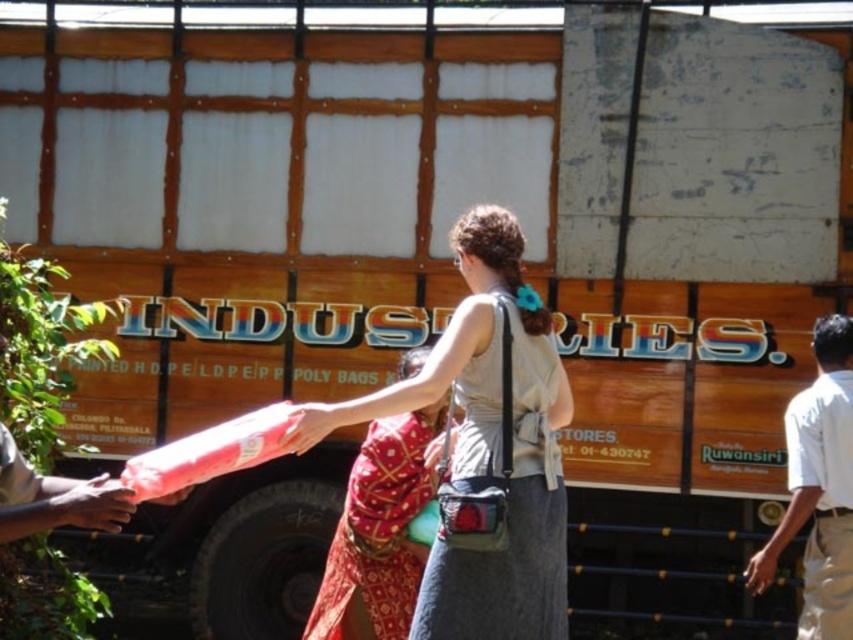
Question: Which of the following is the closest to the observer?

Choices:
 (A) matte red bag at center
 (B) smooth skin hand at lower left

Answer: (B)

Question: Estimate the real-world distances between objects in this image. Which object is closer to the pink fabric at center?

Choices:
 (A) matte beige tank top at center
 (B) red printed pants at center
 (C) matte red bag at center

Answer: (A)

Question: Can you confirm if matte black hand at lower right is positioned to the left of matte red bag at center?

Choices:
 (A) no
 (B) yes

Answer: (A)

Question: Observing the image, what is the correct spatial positioning of matte beige tank top at center in reference to pink fabric at center?

Choices:
 (A) left
 (B) right

Answer: (B)

Question: Which point appears farthest from the camera in this image?

Choices:
 (A) (450, 448)
 (B) (96, 508)
 (C) (361, 529)
 (D) (746, 582)

Answer: (D)

Question: Is matte beige tank top at center bigger than matte red bag at center?

Choices:
 (A) yes
 (B) no

Answer: (A)